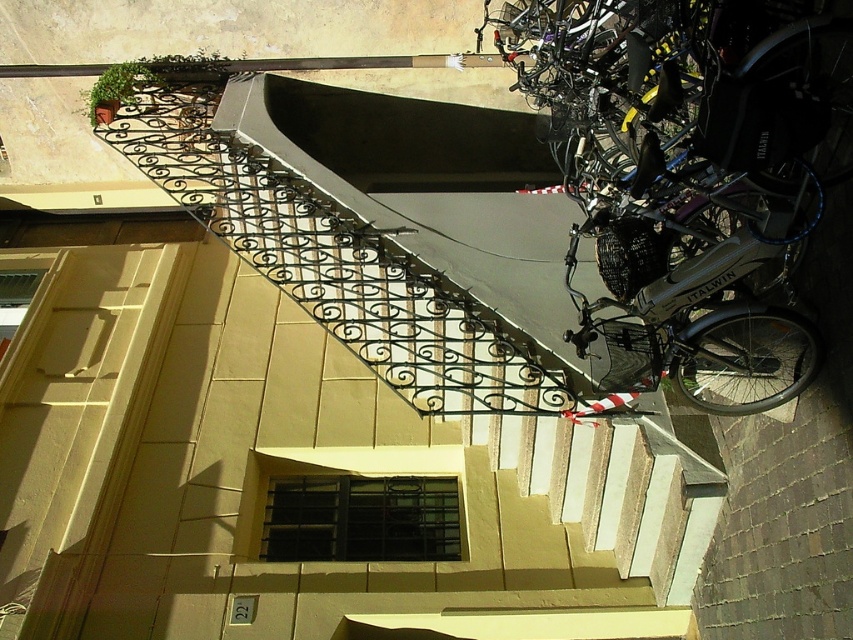
Is smooth concrete stairs at center closer to the viewer compared to silver metallic bicycle at right?

No, it is behind silver metallic bicycle at right.

Can you confirm if smooth concrete stairs at center is positioned below silver metallic bicycle at right?

Correct, smooth concrete stairs at center is located below silver metallic bicycle at right.

The width and height of the screenshot is (853, 640). I want to click on smooth concrete stairs at center, so click(376, 419).